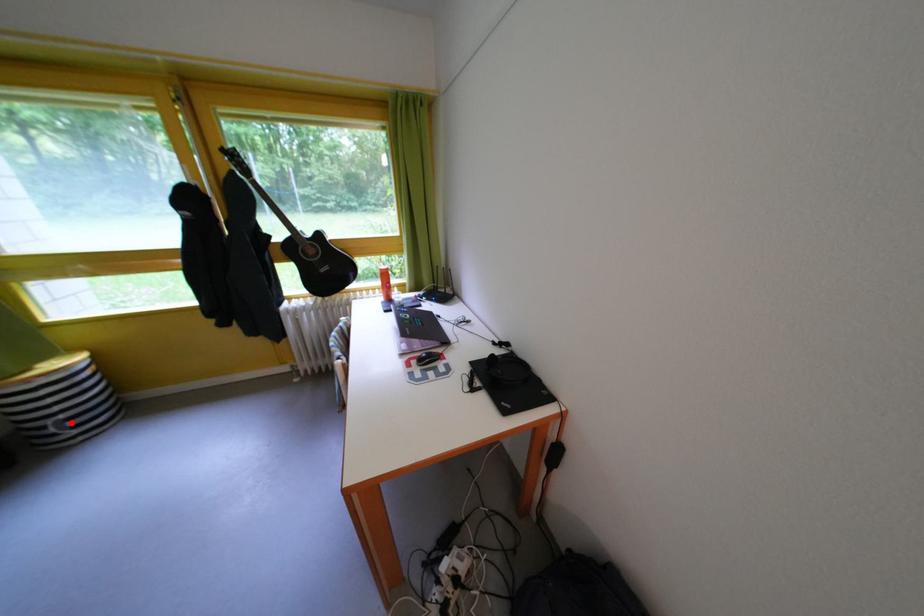
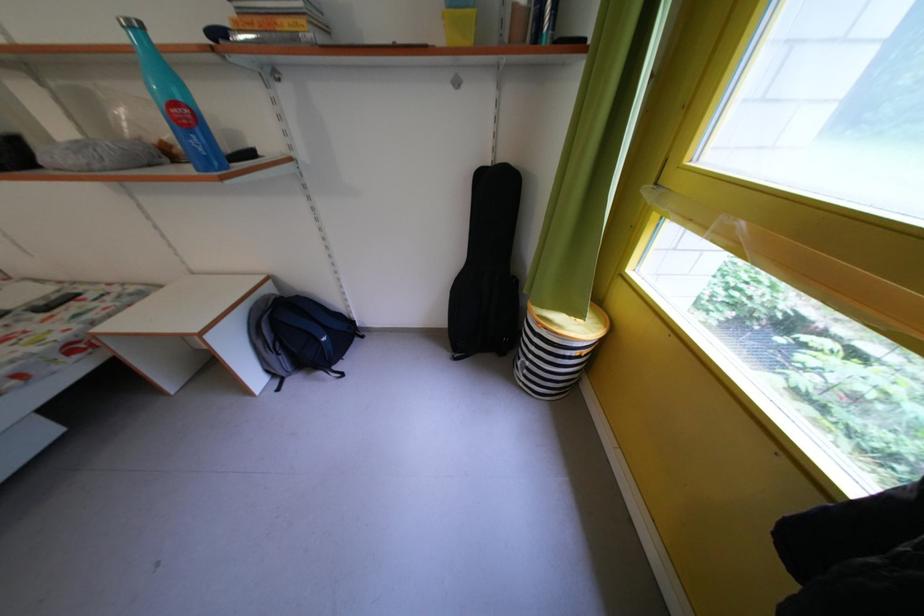
Question: I am providing you with two images of the same scene from different viewpoints. A red point is shown in image1. For the corresponding object point in image2, is it positioned nearer or farther from the camera?

Choices:
 (A) Nearer
 (B) Farther

Answer: (B)